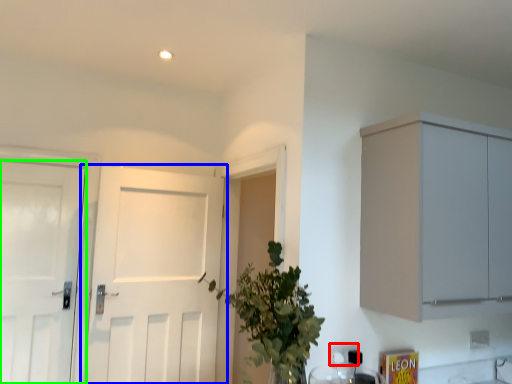
Question: Which object is positioned closest to electric outlet (highlighted by a red box)? Select from door (highlighted by a blue box) and door (highlighted by a green box).

Choices:
 (A) door
 (B) door

Answer: (A)